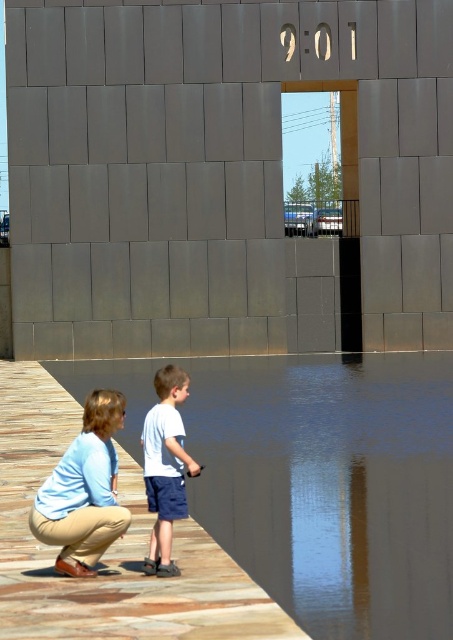
Does wooden at lower left have a greater height compared to white cotton shirt at center?

Yes.

Between wooden at lower left and white cotton shirt at center, which one appears on the right side from the viewer's perspective?

white cotton shirt at center is more to the right.

Find the location of a particular element. The image size is (453, 640). wooden at lower left is located at coordinates (109, 548).

Can you confirm if light blue cotton shirt at lower left is bigger than white cotton shirt at center?

Yes, light blue cotton shirt at lower left is bigger than white cotton shirt at center.

Is point (48, 502) less distant than point (177, 401)?

Yes, point (48, 502) is closer to viewer.

Which is in front, point (67, 540) or point (157, 458)?

Point (67, 540) is more forward.

Where is `light blue cotton shirt at lower left`? The image size is (453, 640). light blue cotton shirt at lower left is located at coordinates (83, 490).

Is wooden at lower left wider than light blue cotton shirt at lower left?

Yes, wooden at lower left is wider than light blue cotton shirt at lower left.

Between wooden at lower left and light blue cotton shirt at lower left, which one has less height?

wooden at lower left is shorter.

Is point (63, 595) more distant than point (101, 547)?

No.

Image resolution: width=453 pixels, height=640 pixels. I want to click on wooden at lower left, so click(109, 548).